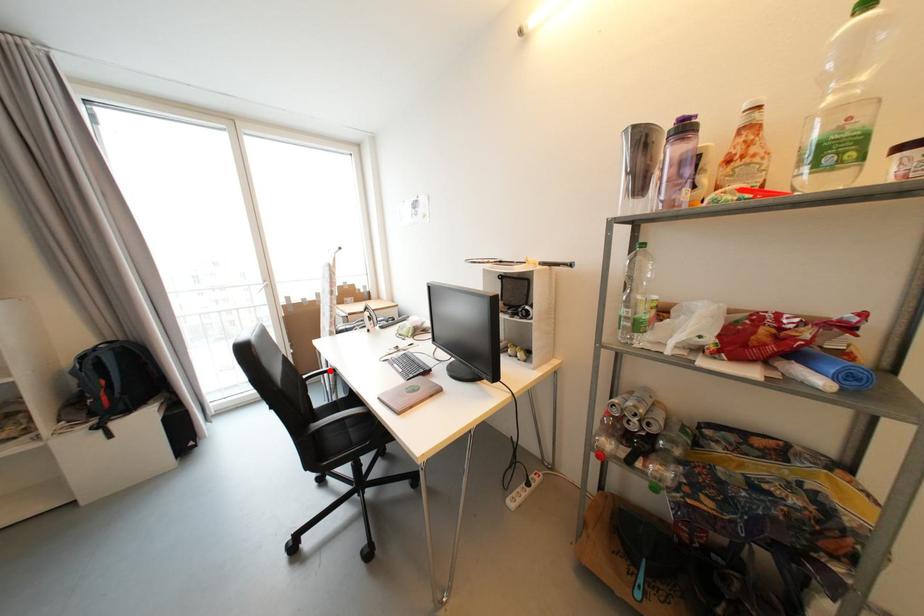
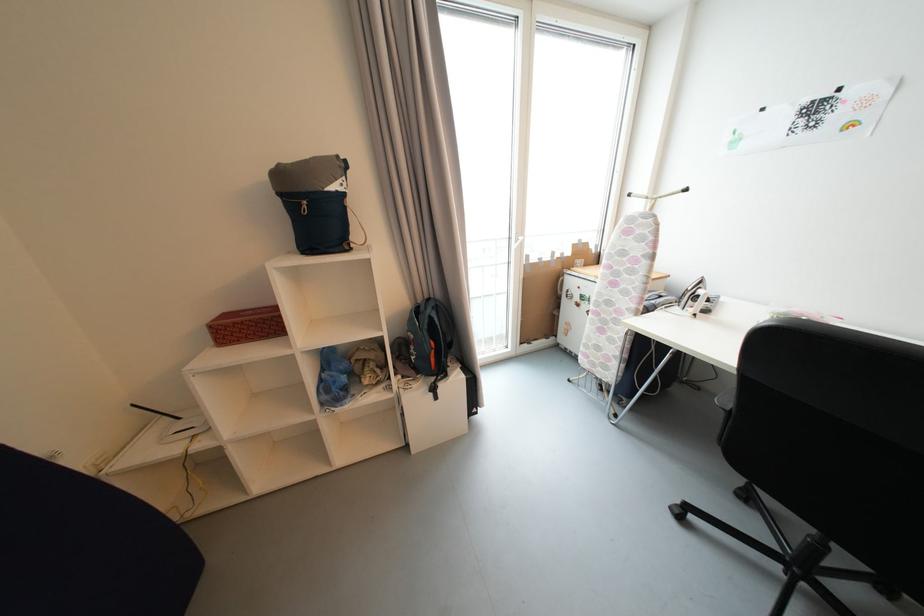
Question: I am providing you with two images of the same scene from different viewpoints. A red point is marked on the first image. Is the red point's position out of view in image 2?

Choices:
 (A) Yes
 (B) No

Answer: (A)